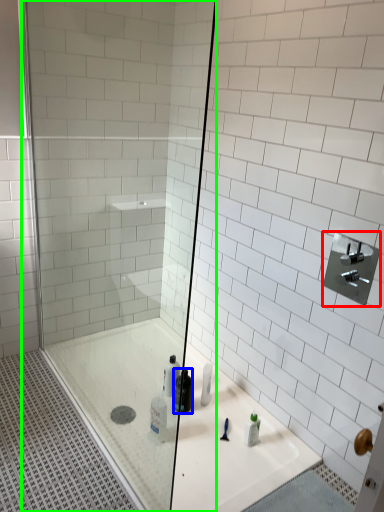
Question: Based on their relative distances, which object is nearer to shower (highlighted by a red box)? Choose from mouthwash (highlighted by a blue box) and shower door (highlighted by a green box).

Choices:
 (A) mouthwash
 (B) shower door

Answer: (A)